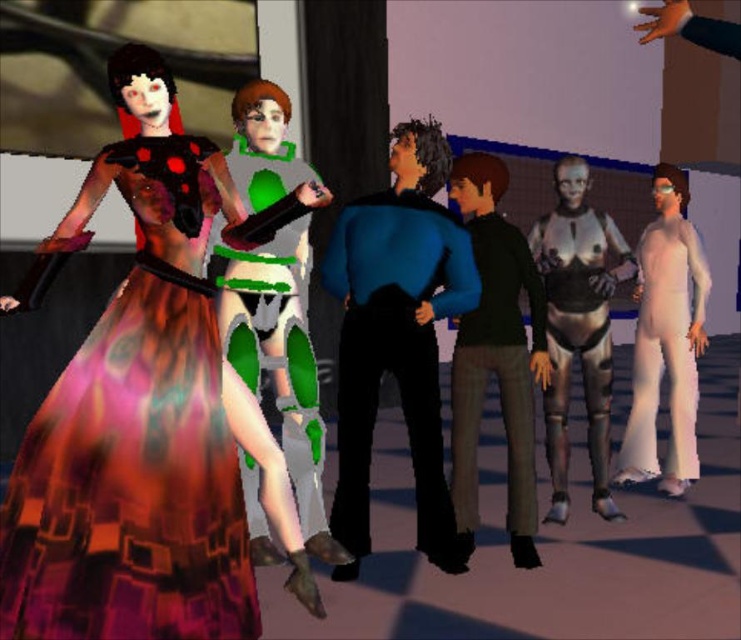
In the scene shown: You are a character in this scene and need to choose a suit that is more likely to be noticed by others. Which one would you pick between the metallic silver suit at center and the white matte jumpsuit at right?

The metallic silver suit at center is smaller than the white matte jumpsuit at right, so the white matte jumpsuit at right is larger and more likely to be noticed due to its size.

You are navigating through a virtual environment and need to reach a checkpoint located at point (525, 388). There is an obstacle at point (285, 436) blocking your path. Can you go around it to reach your destination?

Point (285, 436) is in front of point (525, 388), so you can go around the obstacle at point (285, 436) to reach your destination at point (525, 388).

You are a character in the scene and need to quickly access an item hidden behind the black matte pants at center and metallic silver suit at center. Which object should you move first to reach the item behind both?

You should move the black matte pants at center first since it is in front of the metallic silver suit at center, so moving it first will allow access to the area behind both objects.